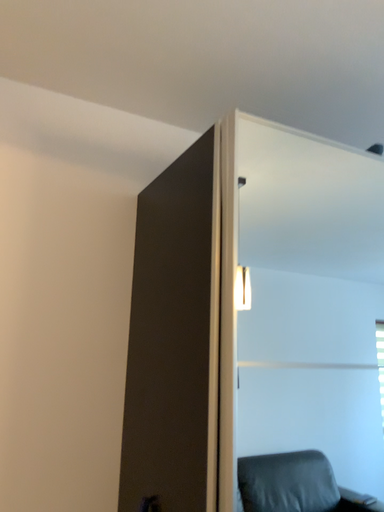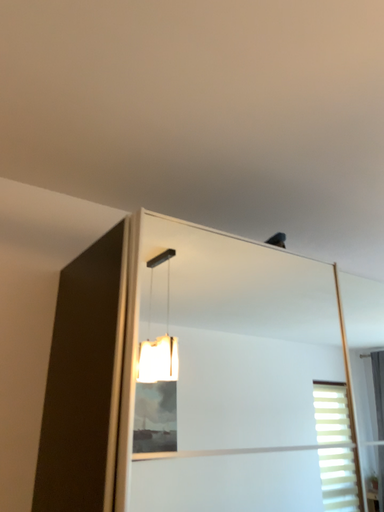
Question: Which way did the camera rotate in the video?

Choices:
 (A) rotated left
 (B) rotated right

Answer: (B)